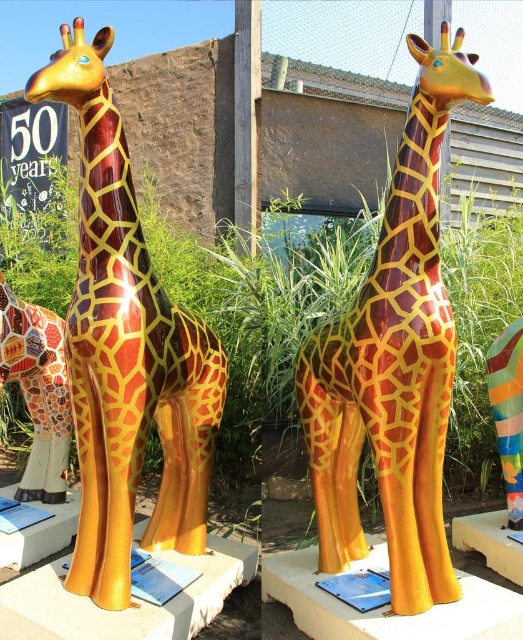
Between shiny gold giraffe at center and shiny plastic giraffe at center, which one is positioned lower?

Positioned lower is shiny plastic giraffe at center.

Which is in front, point (226, 360) or point (315, 353)?

Point (315, 353) is in front.

This screenshot has width=523, height=640. What do you see at coordinates (127, 349) in the screenshot?
I see `shiny gold giraffe at center` at bounding box center [127, 349].

You are a GUI agent. You are given a task and a screenshot of the screen. Output one action in this format:
    pyautogui.click(x=<x>, y=<y>)
    Task: Click on the shiny gold giraffe at center
    Image resolution: width=523 pixels, height=640 pixels.
    Given the screenshot: What is the action you would take?
    pyautogui.click(x=127, y=349)

Looking at this image, is shiny gold giraffe at center thinner than glossy blue plaque at lower left?

Incorrect, shiny gold giraffe at center's width is not less than glossy blue plaque at lower left's.

The height and width of the screenshot is (640, 523). What do you see at coordinates (127, 349) in the screenshot?
I see `shiny gold giraffe at center` at bounding box center [127, 349].

Is point (140, 248) positioned after point (139, 554)?

That is False.

This screenshot has width=523, height=640. I want to click on shiny gold giraffe at center, so click(127, 349).

Which of these two, mosaic-patterned giraffe at left or glossy blue plaque at lower left, stands taller?

mosaic-patterned giraffe at left

Is point (32, 332) in front of point (181, 566)?

That is False.

Image resolution: width=523 pixels, height=640 pixels. I want to click on mosaic-patterned giraffe at left, so click(38, 390).